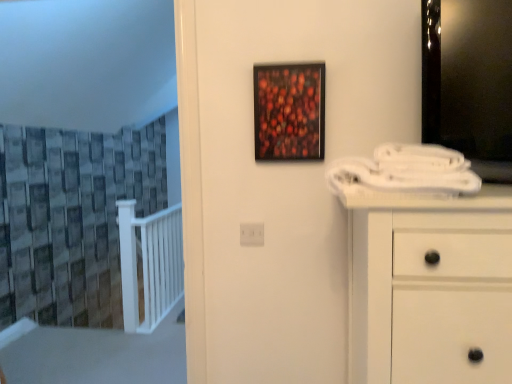
What do you see at coordinates (71, 219) in the screenshot?
I see `textured gray curtain at left` at bounding box center [71, 219].

Describe the element at coordinates (252, 234) in the screenshot. I see `white plastic electric outlet at center` at that location.

The height and width of the screenshot is (384, 512). I want to click on textured gray curtain at left, so click(x=71, y=219).

From the image's perspective, does white plastic electric outlet at center appear higher than wooden-framed artwork at center?

No.

Can you confirm if white plastic electric outlet at center is smaller than wooden-framed artwork at center?

Yes.

Between point (242, 237) and point (296, 139), which one is positioned in front?

Point (296, 139)

Is white plastic electric outlet at center aimed at wooden-framed artwork at center?

No, white plastic electric outlet at center does not turn towards wooden-framed artwork at center.

Where is `electric outlet behind the wooden-framed artwork at center`? This screenshot has width=512, height=384. electric outlet behind the wooden-framed artwork at center is located at coordinates (252, 234).

Is the surface of wooden-framed artwork at center in direct contact with white plastic electric outlet at center?

No, wooden-framed artwork at center is not next to white plastic electric outlet at center.

From a real-world perspective, relative to white plastic electric outlet at center, is wooden-framed artwork at center vertically above or below?

From a real-world perspective, wooden-framed artwork at center is physically above white plastic electric outlet at center.

Which of these two, wooden-framed artwork at center or white plastic electric outlet at center, is thinner?

white plastic electric outlet at center is thinner.

Can you confirm if white plastic electric outlet at center is positioned to the right of textured gray curtain at left?

Yes, white plastic electric outlet at center is to the right of textured gray curtain at left.

Is white plastic electric outlet at center wider than textured gray curtain at left?

No, white plastic electric outlet at center is not wider than textured gray curtain at left.

Does white plastic electric outlet at center have a smaller size compared to textured gray curtain at left?

Indeed, white plastic electric outlet at center has a smaller size compared to textured gray curtain at left.

Is textured gray curtain at left thinner than white plastic electric outlet at center?

No.

Can you confirm if textured gray curtain at left is positioned to the right of white plastic electric outlet at center?

No, textured gray curtain at left is not to the right of white plastic electric outlet at center.

Is textured gray curtain at left taller or shorter than white plastic electric outlet at center?

In the image, textured gray curtain at left appears to be taller than white plastic electric outlet at center.

From the image's perspective, between textured gray curtain at left and white plastic electric outlet at center, who is located below?

white plastic electric outlet at center.

Visually, is wooden-framed artwork at center positioned to the left or to the right of textured gray curtain at left?

Clearly, wooden-framed artwork at center is on the right of textured gray curtain at left in the image.

Considering the sizes of objects wooden-framed artwork at center and textured gray curtain at left in the image provided, who is bigger, wooden-framed artwork at center or textured gray curtain at left?

textured gray curtain at left is bigger.

Which is less distant, (x=291, y=121) or (x=36, y=185)?

Point (x=291, y=121) is positioned closer to the camera compared to point (x=36, y=185).

What are the coordinates of `picture frame that is above the textured gray curtain at left (from a real-world perspective)` in the screenshot? It's located at (289, 111).

Considering the sizes of textured gray curtain at left and wooden-framed artwork at center in the image, is textured gray curtain at left wider or thinner than wooden-framed artwork at center?

Considering their sizes, textured gray curtain at left looks broader than wooden-framed artwork at center.

Does textured gray curtain at left turn towards wooden-framed artwork at center?

No, textured gray curtain at left is not aimed at wooden-framed artwork at center.

From the image's perspective, between textured gray curtain at left and wooden-framed artwork at center, who is located below?

textured gray curtain at left.

Are textured gray curtain at left and wooden-framed artwork at center far apart?

Yes, textured gray curtain at left and wooden-framed artwork at center are located far from each other.

At what (x,y) coordinates should I click in order to perform the action: click on electric outlet below the wooden-framed artwork at center (from a real-world perspective). Please return your answer as a coordinate pair (x, y). Looking at the image, I should click on (252, 234).

This screenshot has width=512, height=384. What are the coordinates of `electric outlet lying behind the wooden-framed artwork at center` in the screenshot? It's located at (252, 234).

Looking at this image, estimate the real-world distances between objects in this image. Which object is closer to textured gray curtain at left, white plastic electric outlet at center or wooden-framed artwork at center?

wooden-framed artwork at center is positioned closer to the anchor textured gray curtain at left.

Looking at the image, which one is located closer to wooden-framed artwork at center, white plastic electric outlet at center or textured gray curtain at left?

white plastic electric outlet at center is closer to wooden-framed artwork at center.

Which object lies further to the anchor point white plastic electric outlet at center, wooden-framed artwork at center or textured gray curtain at left?

Among the two, textured gray curtain at left is located further to white plastic electric outlet at center.

Looking at this image, considering their positions, is textured gray curtain at left positioned closer to white plastic electric outlet at center than wooden-framed artwork at center?

wooden-framed artwork at center.

Looking at the image, which one is located closer to textured gray curtain at left, wooden-framed artwork at center or white plastic electric outlet at center?

wooden-framed artwork at center is closer to textured gray curtain at left.

Based on their spatial positions, is textured gray curtain at left or white plastic electric outlet at center further from wooden-framed artwork at center?

textured gray curtain at left.

I want to click on electric outlet between textured gray curtain at left and wooden-framed artwork at center in the horizontal direction, so click(252, 234).